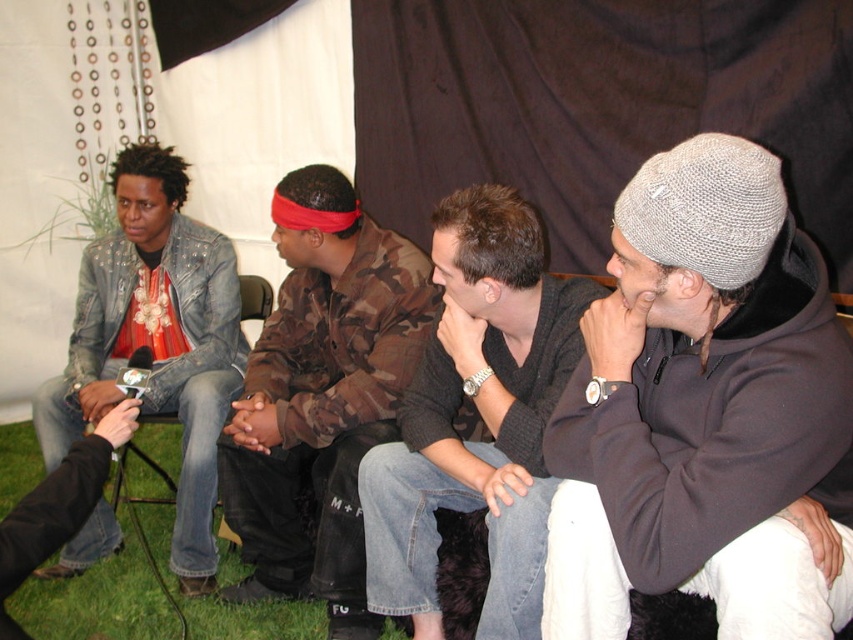
You are a photographer trying to capture a group photo of the dark gray knit beanie at center and the denim jacket at left. Since you want to ensure both subjects are framed properly, which one should be placed to the right side in the photo?

The dark gray knit beanie at center should be placed to the right side of the denim jacket at left in the photo because it is already positioned on the right side of the denim jacket at left in the scene.

Is the point at position (321, 397) located on the camo jacket at center?

Yes, the point at position (321, 397) is located on the camo jacket at center.

You are a photographer trying to capture a closeup of the knitted gray beanie at center and denim jacket at left. Which object should you focus on first if you want to ensure both are in focus?

The knitted gray beanie at center is below the denim jacket at left, so you should focus on the denim jacket at left first since it is closer to the camera.